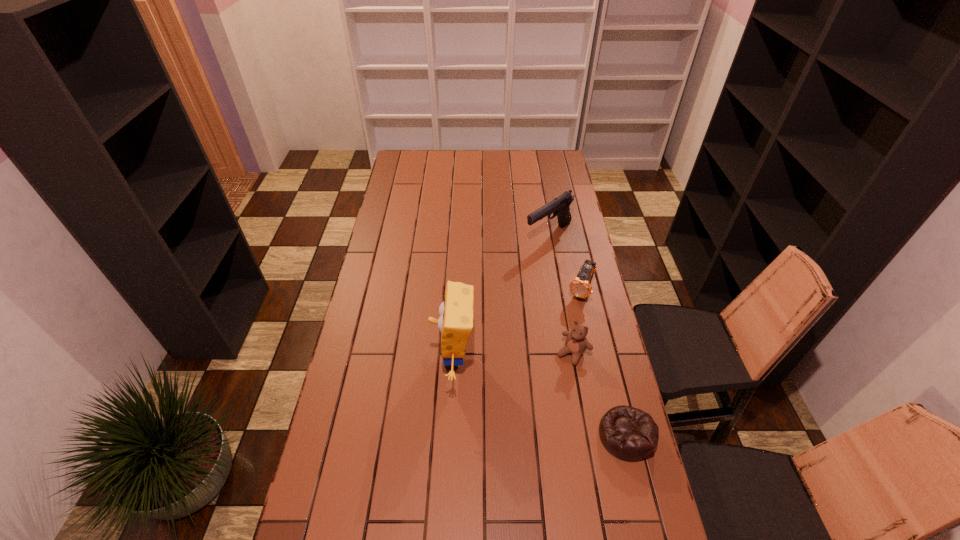
Where is `vacant space located on the face of the sponge`? The image size is (960, 540). vacant space located on the face of the sponge is located at coordinates (392, 359).

This screenshot has height=540, width=960. Identify the location of free space located on the back of the beanbag. (604, 343).

Where is `free region located at the muzzle of the fourth shortest object`? free region located at the muzzle of the fourth shortest object is located at coordinates (542, 281).

This screenshot has height=540, width=960. Find the location of `vacant space situated 0.190m at the muzzle of the fourth shortest object`. vacant space situated 0.190m at the muzzle of the fourth shortest object is located at coordinates (542, 282).

The image size is (960, 540). In order to click on free space located 0.220m at the muzzle of the fourth shortest object in this screenshot , I will do `click(541, 288)`.

Find the location of a particular element. vacant space situated 0.330m on the face of the watch is located at coordinates (543, 371).

The width and height of the screenshot is (960, 540). Identify the location of vacant space located 0.230m on the face of the watch. (554, 349).

Identify the location of vacant area situated on the face of the watch. The height and width of the screenshot is (540, 960). (540, 378).

Image resolution: width=960 pixels, height=540 pixels. Find the location of `vacant space positioned on the front-facing side of the teddy bear`. vacant space positioned on the front-facing side of the teddy bear is located at coordinates (557, 374).

This screenshot has height=540, width=960. I want to click on free space located on the front-facing side of the teddy bear, so [x=542, y=394].